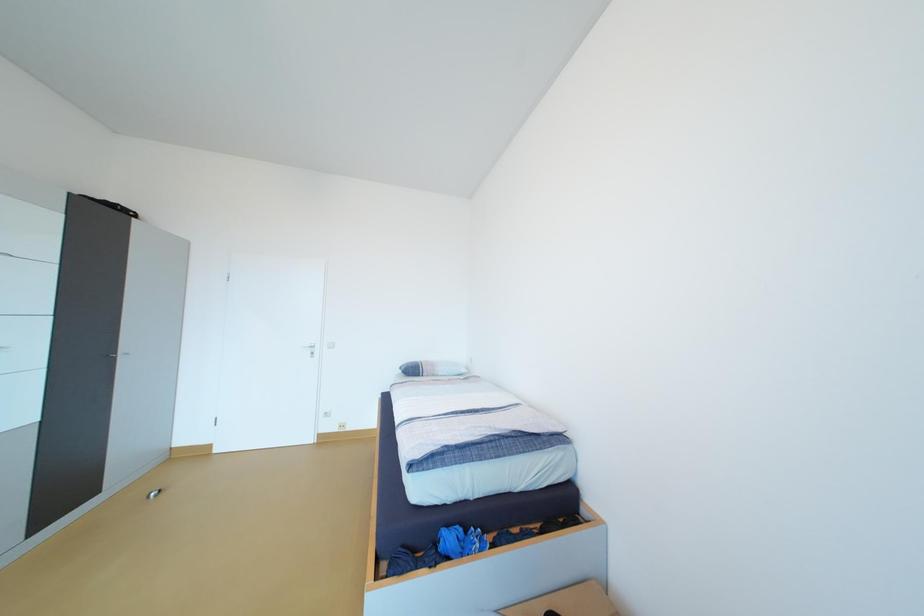
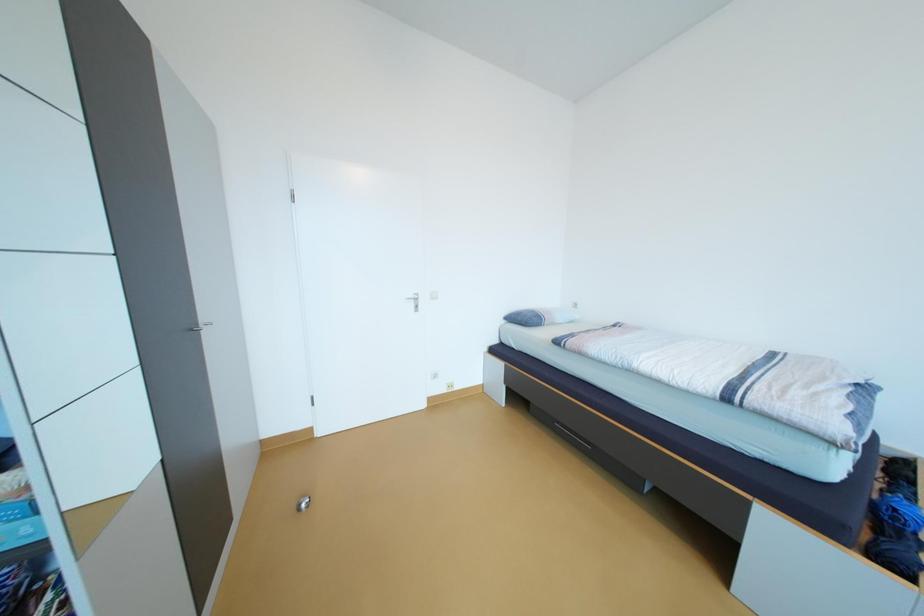
What movement of the cameraman would produce the second image?

The cameraman moved toward left, forward.